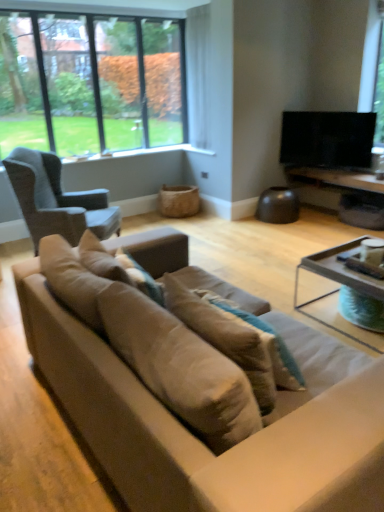
At what (x,y) coordinates should I click in order to perform the action: click on suede-like beige pillow at center, which ranks as the 2th pillow in left-to-right order. Please return your answer as a coordinate pair (x, y). Looking at the image, I should click on (263, 342).

You are a GUI agent. You are given a task and a screenshot of the screen. Output one action in this format:
    pyautogui.click(x=<x>, y=<y>)
    Task: Click on the suede couch at center
    
    Given the screenshot: What is the action you would take?
    pyautogui.click(x=196, y=437)

The height and width of the screenshot is (512, 384). What do you see at coordinates (338, 274) in the screenshot?
I see `translucent glass coffee table at right` at bounding box center [338, 274].

Where is `suede-like beige pillow at center, positioned as the 1th pillow in right-to-left order`? Image resolution: width=384 pixels, height=512 pixels. suede-like beige pillow at center, positioned as the 1th pillow in right-to-left order is located at coordinates (263, 342).

Is white sheer curtain at upper center spatially inside translucent glass coffee table at right, or outside of it?

white sheer curtain at upper center exists outside the volume of translucent glass coffee table at right.

From a real-world perspective, is white sheer curtain at upper center positioned under translucent glass coffee table at right based on gravity?

Incorrect, from a real-world perspective, white sheer curtain at upper center is higher than translucent glass coffee table at right.

What's the angular difference between white sheer curtain at upper center and translucent glass coffee table at right's facing directions?

The angular difference between white sheer curtain at upper center and translucent glass coffee table at right is 0.521 degrees.

Between point (203, 7) and point (351, 282), which one is positioned in front?

The point (351, 282) is closer to the camera.

Looking at this image, between wooden tray at lower right and suede-like beige pillow at center, acting as the 1th pillow starting from the left, which one has less height?

wooden tray at lower right.

Would you say wooden tray at lower right is to the left or to the right of suede-like beige pillow at center, acting as the 1th pillow starting from the left, in the picture?

wooden tray at lower right is positioned on suede-like beige pillow at center, acting as the 1th pillow starting from the left,'s right side.

Is wooden tray at lower right thinner than suede-like beige pillow at center, acting as the 2th pillow starting from the right?

No.

Is suede-like beige pillow at center, acting as the 2th pillow starting from the right, thinner than translucent glass coffee table at right?

Yes.

Who is more distant, suede-like beige pillow at center, acting as the 2th pillow starting from the right, or translucent glass coffee table at right?

translucent glass coffee table at right is behind.

Is there a large distance between suede-like beige pillow at center, acting as the 2th pillow starting from the right, and translucent glass coffee table at right?

Indeed, suede-like beige pillow at center, acting as the 2th pillow starting from the right, is not near translucent glass coffee table at right.

From the image's perspective, which is below, suede-like beige pillow at center, acting as the 1th pillow starting from the left, or translucent glass coffee table at right?

translucent glass coffee table at right is shown below in the image.

Would you say suede couch at center is to the left or to the right of clear glass window at upper left in the picture?

suede couch at center is to the right of clear glass window at upper left.

Based on the photo, is suede couch at center positioned in front of clear glass window at upper left?

Yes, suede couch at center is closer to the camera.

Could you tell me if suede couch at center is turned towards clear glass window at upper left?

Yes, suede couch at center is aimed at clear glass window at upper left.

From the image's perspective, is suede couch at center on top of clear glass window at upper left?

Incorrect, from the image's perspective, suede couch at center is lower than clear glass window at upper left.

Consider the image. Considering the sizes of objects suede-like beige pillow at center, acting as the 1th pillow starting from the left, and dark gray fabric chair at left in the image provided, who is bigger, suede-like beige pillow at center, acting as the 1th pillow starting from the left, or dark gray fabric chair at left?

With larger size is dark gray fabric chair at left.

From the image's perspective, is suede-like beige pillow at center, acting as the 2th pillow starting from the right, on dark gray fabric chair at left?

No, from the image's perspective, suede-like beige pillow at center, acting as the 2th pillow starting from the right, is not above dark gray fabric chair at left.

How much distance is there between suede-like beige pillow at center, acting as the 2th pillow starting from the right, and dark gray fabric chair at left?

suede-like beige pillow at center, acting as the 2th pillow starting from the right, and dark gray fabric chair at left are 1.63 meters apart from each other.

Is suede-like beige pillow at center, acting as the 1th pillow starting from the left, inside or outside of dark gray fabric chair at left?

suede-like beige pillow at center, acting as the 1th pillow starting from the left, lies outside dark gray fabric chair at left.

From the image's perspective, which object appears higher, translucent glass coffee table at right or dark gray fabric chair at left?

dark gray fabric chair at left.

Based on the photo, is translucent glass coffee table at right oriented towards dark gray fabric chair at left?

No, translucent glass coffee table at right does not turn towards dark gray fabric chair at left.

Would you consider translucent glass coffee table at right to be distant from dark gray fabric chair at left?

translucent glass coffee table at right is far away from dark gray fabric chair at left.

Does point (350, 285) appear closer or farther from the camera than point (90, 223)?

Clearly, point (350, 285) is closer to the camera than point (90, 223).

Considering the sizes of objects transparent glass window screen at upper right and dark gray fabric chair at left in the image provided, who is taller, transparent glass window screen at upper right or dark gray fabric chair at left?

transparent glass window screen at upper right.

How distant is transparent glass window screen at upper right from dark gray fabric chair at left?

transparent glass window screen at upper right and dark gray fabric chair at left are 3.92 meters apart from each other.

Are transparent glass window screen at upper right and dark gray fabric chair at left far apart?

transparent glass window screen at upper right is far away from dark gray fabric chair at left.

Which is less distant, (377,19) or (107,226)?

Point (377,19) is positioned farther from the camera compared to point (107,226).

Where is `coffee table located in front of the white sheer curtain at upper center`? This screenshot has width=384, height=512. coffee table located in front of the white sheer curtain at upper center is located at coordinates (338, 274).

The image size is (384, 512). Identify the location of table above the suede-like beige pillow at center, acting as the 2th pillow starting from the right (from the image's perspective). (347, 193).

Looking at the image, which one is located closer to black glossy tv at upper right, suede couch at center or white sheer curtain at upper center?

The object closer to black glossy tv at upper right is white sheer curtain at upper center.

Estimate the real-world distances between objects in this image. Which object is closer to dark gray fabric chair at left, clear glass window at upper left or white sheer curtain at upper center?

The object closer to dark gray fabric chair at left is clear glass window at upper left.

Considering their positions, is suede-like beige pillow at center, which ranks as the 2th pillow in left-to-right order, positioned further to transparent glass window screen at upper right than suede couch at center?

suede couch at center.

Which object lies nearer to the anchor point suede couch at center, dark gray fabric chair at left or white sheer curtain at upper center?

dark gray fabric chair at left is closer to suede couch at center.

Which object lies further to the anchor point clear glass window at upper left, suede couch at center or translucent glass coffee table at right?

Based on the image, suede couch at center appears to be further to clear glass window at upper left.

Considering their positions, is transparent glass window screen at upper right positioned further to clear glass window at upper left than suede-like beige pillow at center, acting as the 1th pillow starting from the left?

suede-like beige pillow at center, acting as the 1th pillow starting from the left, is further to clear glass window at upper left.

Looking at the image, which one is located closer to suede-like beige pillow at center, acting as the 2th pillow starting from the right, white sheer curtain at upper center or transparent glass window screen at upper right?

white sheer curtain at upper center.

Based on the photo, when comparing their distances from suede couch at center, does translucent glass coffee table at right or dark gray fabric chair at left seem further?

dark gray fabric chair at left is further to suede couch at center.

Where is `window between suede-like beige pillow at center, which ranks as the 2th pillow in left-to-right order, and black glossy tv at upper right in the front-back direction`? window between suede-like beige pillow at center, which ranks as the 2th pillow in left-to-right order, and black glossy tv at upper right in the front-back direction is located at coordinates (91, 82).

Find the location of a particular element. coffee table located between suede couch at center and transparent glass window screen at upper right in the depth direction is located at coordinates (338, 274).

At what (x,y) coordinates should I click in order to perform the action: click on curtain between dark gray fabric chair at left and wooden tray at lower right in the horizontal direction. Please return your answer as a coordinate pair (x, y). Looking at the image, I should click on (198, 76).

The height and width of the screenshot is (512, 384). I want to click on table located between clear glass window at upper left and transparent glass window screen at upper right in the left-right direction, so click(x=347, y=193).